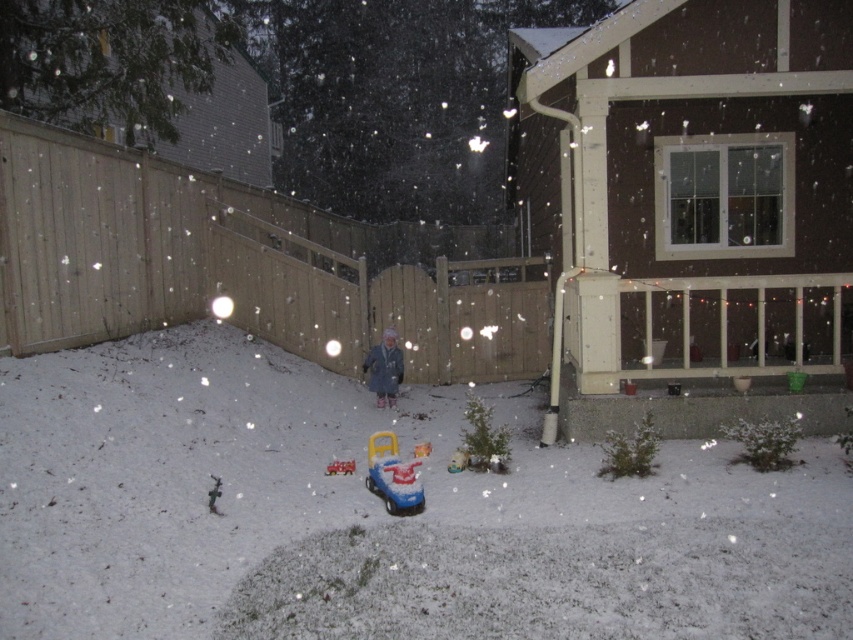
Question: Which object appears farthest from the camera in this image?

Choices:
 (A) shiny plastic toy car at center
 (B) blue plastic toy car at center

Answer: (A)

Question: Is blue plastic toy car at center thinner than matte gray coat at center?

Choices:
 (A) yes
 (B) no

Answer: (A)

Question: Is blue plastic toy car at center positioned behind shiny plastic toy car at center?

Choices:
 (A) no
 (B) yes

Answer: (A)

Question: Which object appears closest to the camera in this image?

Choices:
 (A) shiny plastic toy car at center
 (B) blue plastic toy car at center
 (C) matte gray coat at center

Answer: (B)

Question: Which point is farther to the camera?

Choices:
 (A) matte gray coat at center
 (B) shiny plastic toy car at center

Answer: (A)

Question: Is blue plastic toy car at center above matte gray coat at center?

Choices:
 (A) yes
 (B) no

Answer: (B)